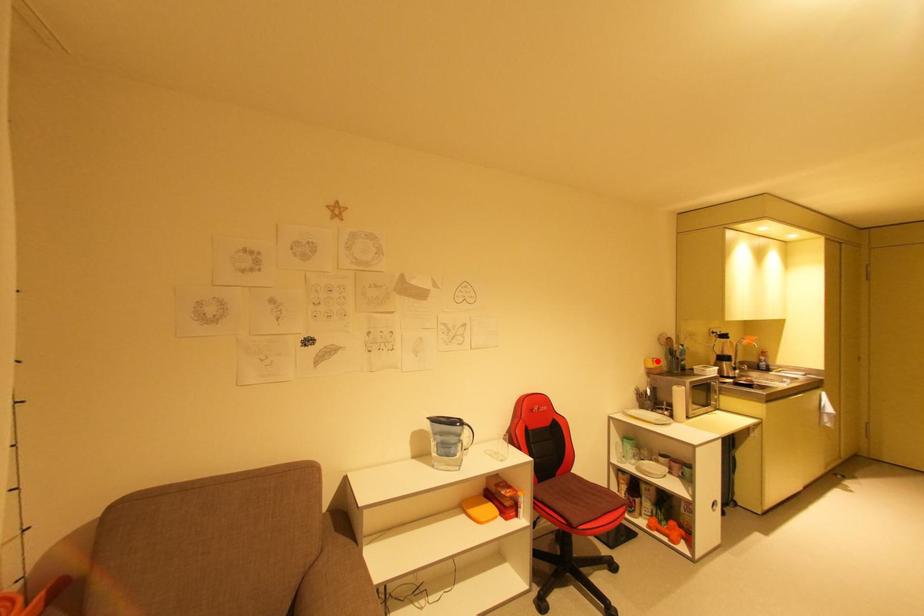
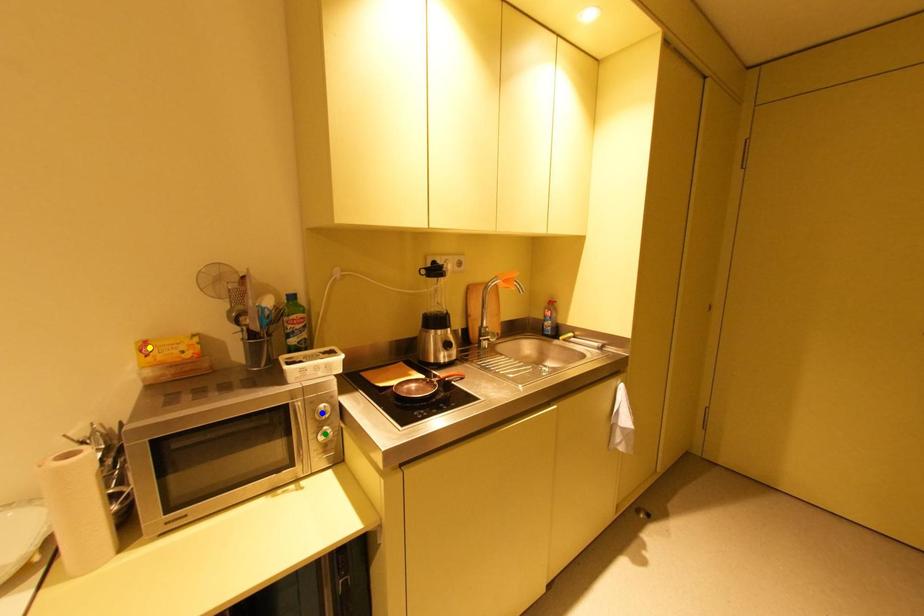
Question: I am providing you with two images of the same scene from different viewpoints. A red point is marked on the first image. You are given multiple points on the second image. Which spot in image 2 lines up with the point in image 1?

Choices:
 (A) green point
 (B) yellow point
 (C) blue point

Answer: (B)